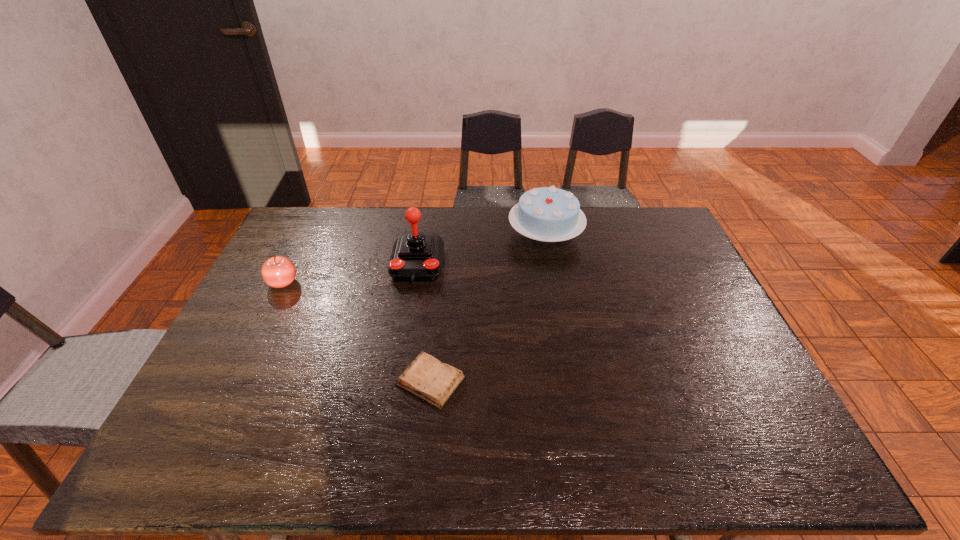
Locate an element on the screen. The width and height of the screenshot is (960, 540). object that ranks as the closest to the tallest object is located at coordinates pyautogui.click(x=549, y=214).

I want to click on object that is the second nearest to the third tallest object, so click(426, 377).

The width and height of the screenshot is (960, 540). Identify the location of vacant space that satisfies the following two spatial constraints: 1. on the base of the diary; 2. on the left side of the tallest object. tap(398, 381).